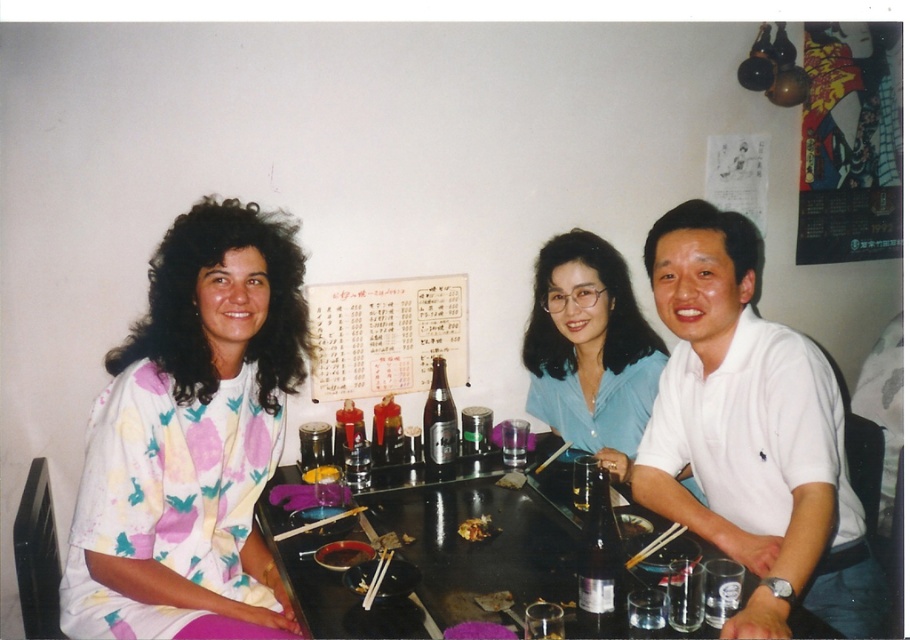
Which is below, black glass table at center or golden crispy fried chicken at center?

golden crispy fried chicken at center is below.

Who is more forward, [704,630] or [464,522]?

Positioned in front is point [704,630].

Measure the distance between black glass table at center and camera.

black glass table at center is 4.16 feet away from camera.

Image resolution: width=910 pixels, height=640 pixels. Identify the location of black glass table at center. (481, 541).

Can you confirm if blue satin blouse at center is positioned to the left of wooden chopsticks at center?

Yes, blue satin blouse at center is to the left of wooden chopsticks at center.

Looking at this image, is blue satin blouse at center thinner than wooden chopsticks at center?

No, blue satin blouse at center is not thinner than wooden chopsticks at center.

Where is `blue satin blouse at center`? The width and height of the screenshot is (910, 640). blue satin blouse at center is located at coordinates (590, 349).

Consider the image. Who is taller, brown crumbly bread at center or yellow matte rice at center?

yellow matte rice at center is taller.

Does brown crumbly bread at center have a larger size compared to yellow matte rice at center?

Incorrect, brown crumbly bread at center is not larger than yellow matte rice at center.

Is point (500, 609) farther from camera compared to point (337, 474)?

No, it is in front of (337, 474).

Locate an element on the screen. The image size is (910, 640). brown crumbly bread at center is located at coordinates (494, 600).